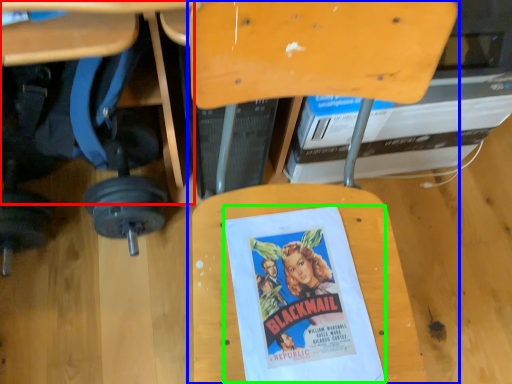
Question: Estimate the real-world distances between objects in this image. Which object is farther from table (highlighted by a red box), chair (highlighted by a blue box) or movie poster (highlighted by a green box)?

Choices:
 (A) chair
 (B) movie poster

Answer: (B)